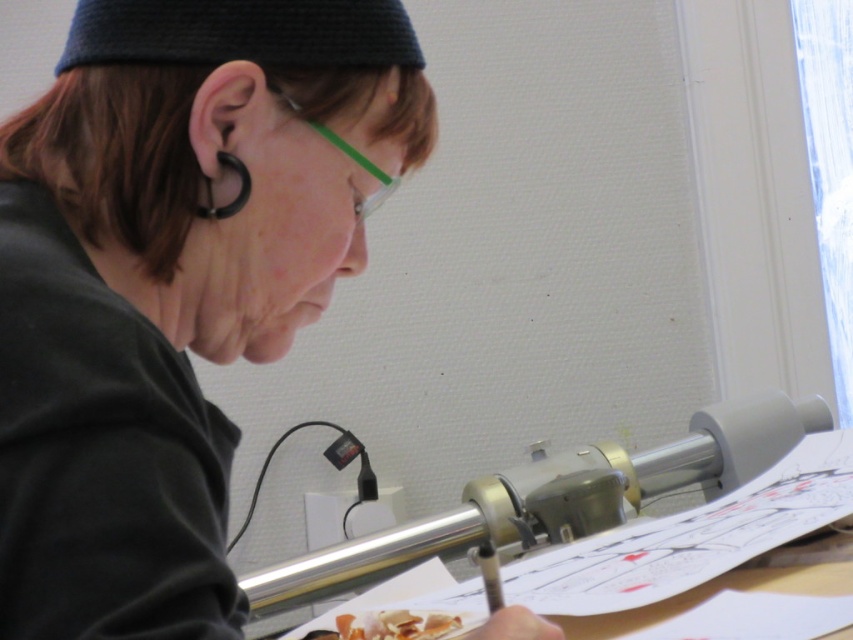
You are trying to determine if the slightly translucent paper at lower center can cover the clear plastic glasses at upper center completely. Based on their sizes, what do you think?

The slightly translucent paper at lower center has a larger width than the clear plastic glasses at upper center, so it can cover them completely.

You are a photographer trying to capture a closeup of the drawing tool. You notice two points marked in the scene at coordinates point (242, 51) and point (370, 173). Which point should you focus on to get the sharpest image of the drawing tool?

Point (242, 51) is closer to the camera than point (370, 173), so focusing on point (242, 51) will result in a sharper image of the drawing tool.

You are an artist who needs to place a rectangular frame that is 10 cm wide on your desk. You see the black matte paper at center and the clear plastic glasses at upper center. Which object can the frame fit next to without overlapping?

The black matte paper at center has a greater width than the clear plastic glasses at upper center, so the frame can fit next to the clear plastic glasses at upper center since it is narrower.